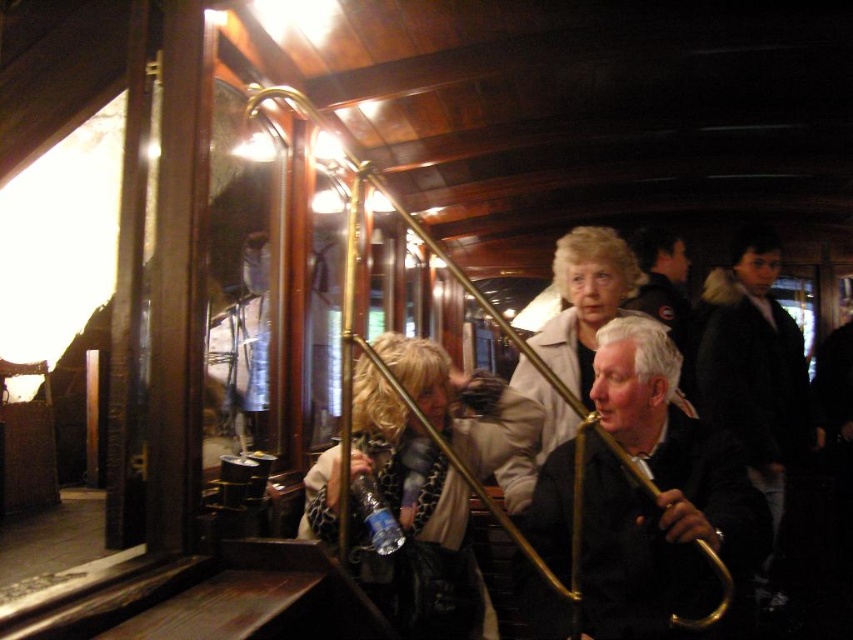
Question: Among these objects, which one is nearest to the camera?

Choices:
 (A) black leather jacket at center
 (B) white textured coat at center
 (C) leopard print scarf at center

Answer: (A)

Question: Does black leather jacket at center have a larger size compared to white textured coat at center?

Choices:
 (A) yes
 (B) no

Answer: (B)

Question: Which of the following is the closest to the observer?

Choices:
 (A) leopard print scarf at center
 (B) black leather jacket at center
 (C) white textured coat at center

Answer: (B)

Question: Is leopard print scarf at center to the right of white textured coat at center from the viewer's perspective?

Choices:
 (A) no
 (B) yes

Answer: (A)

Question: Which object is positioned closest to the black leather jacket at center?

Choices:
 (A) white textured coat at center
 (B) leopard print scarf at center

Answer: (A)

Question: Can you confirm if black leather jacket at center is positioned to the right of white textured coat at center?

Choices:
 (A) no
 (B) yes

Answer: (B)